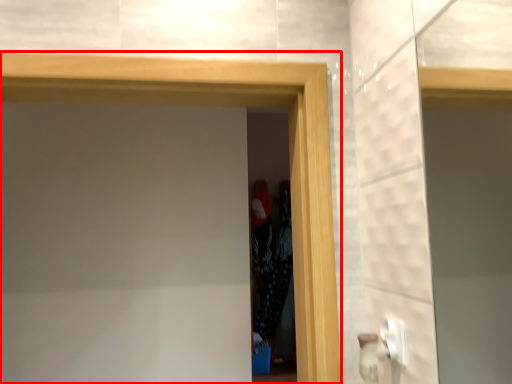
Question: From the image's perspective, what is the correct spatial positioning of screen door (annotated by the red box) in reference to screen door?

Choices:
 (A) below
 (B) above

Answer: (B)